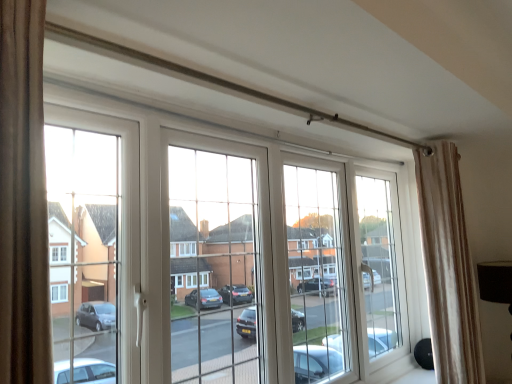
Question: In the image, is beige striped curtain at right positioned in front of or behind white plastic window at center?

Choices:
 (A) front
 (B) behind

Answer: (B)

Question: Is beige striped curtain at right spatially inside white plastic window at center, or outside of it?

Choices:
 (A) inside
 (B) outside

Answer: (B)

Question: Looking at the image, does beige striped curtain at right seem bigger or smaller compared to white plastic window at center?

Choices:
 (A) big
 (B) small

Answer: (B)

Question: Do you think white plastic window at center is within beige striped curtain at right, or outside of it?

Choices:
 (A) inside
 (B) outside

Answer: (B)

Question: In the image, is white plastic window at center positioned in front of or behind beige striped curtain at right?

Choices:
 (A) front
 (B) behind

Answer: (A)

Question: From a real-world perspective, is white plastic window at center above or below beige striped curtain at right?

Choices:
 (A) below
 (B) above

Answer: (B)

Question: Is white plastic window at center wider or thinner than beige striped curtain at right?

Choices:
 (A) wide
 (B) thin

Answer: (B)